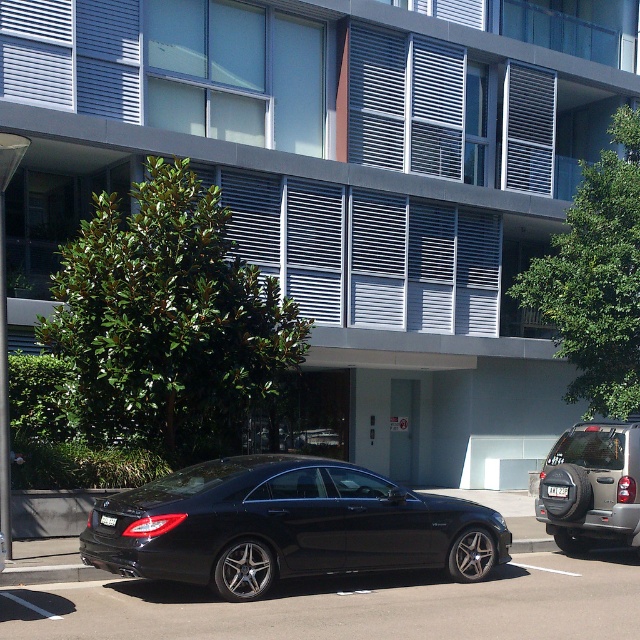
Question: Which point is farther to the camera?

Choices:
 (A) (369, 556)
 (B) (296, 634)
 (C) (586, 451)

Answer: (C)

Question: Is glossy black car at center to the right of shiny black sedan at center from the viewer's perspective?

Choices:
 (A) no
 (B) yes

Answer: (A)

Question: Which point is closer to the camera taking this photo?

Choices:
 (A) (284, 477)
 (B) (346, 616)

Answer: (B)

Question: Can you confirm if glossy black car at center is thinner than shiny black sedan at center?

Choices:
 (A) yes
 (B) no

Answer: (B)

Question: Does glossy black car at center have a lesser width compared to black metallic car at center?

Choices:
 (A) no
 (B) yes

Answer: (A)

Question: Among these objects, which one is farthest from the camera?

Choices:
 (A) shiny black sedan at center
 (B) black metallic car at center
 (C) glossy black car at center

Answer: (A)